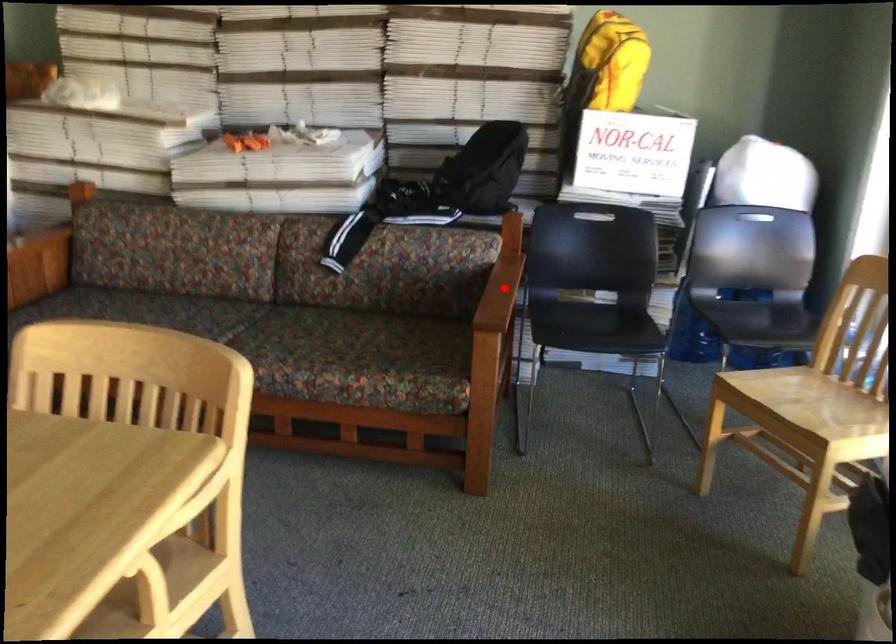
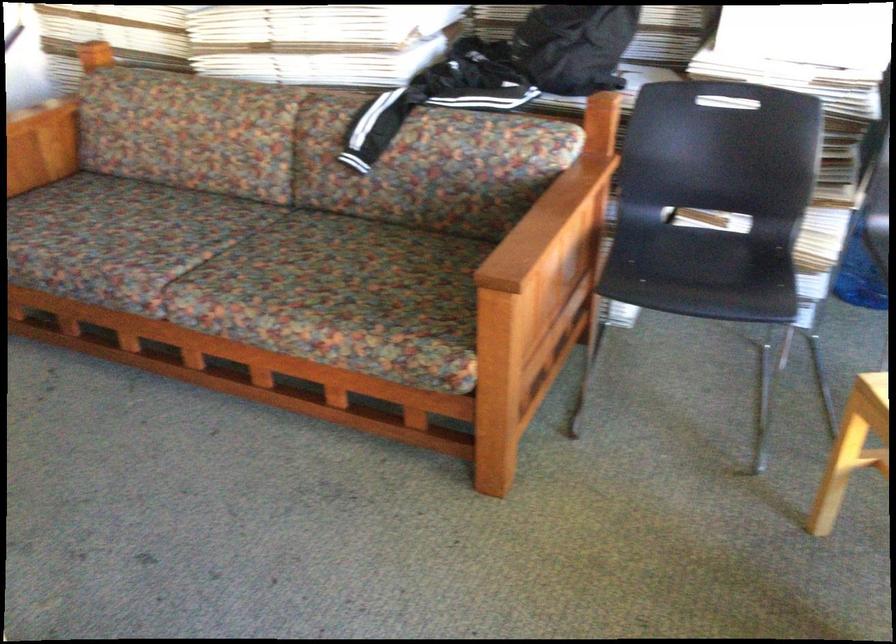
Find the pixel in the second image that matches the highlighted location in the first image.

(545, 222)